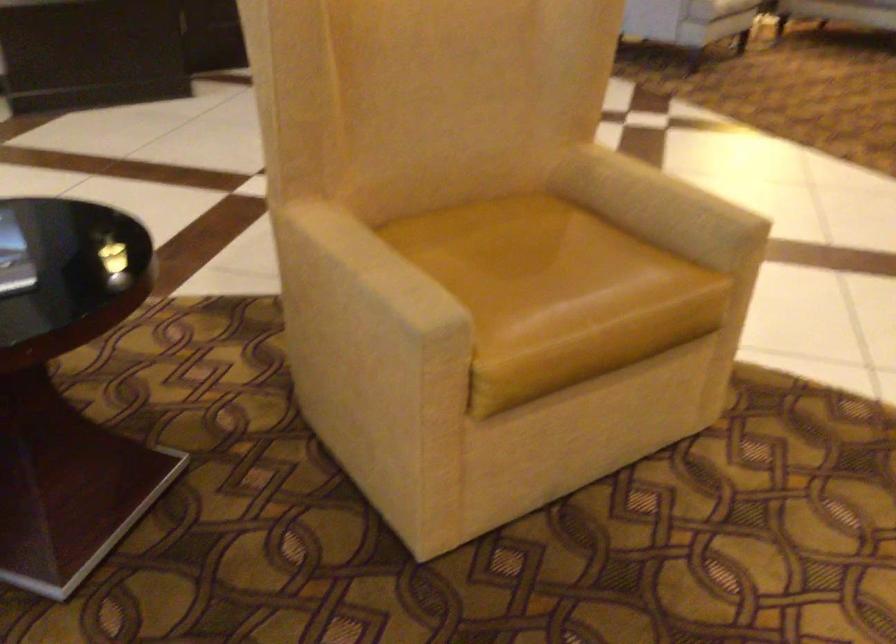
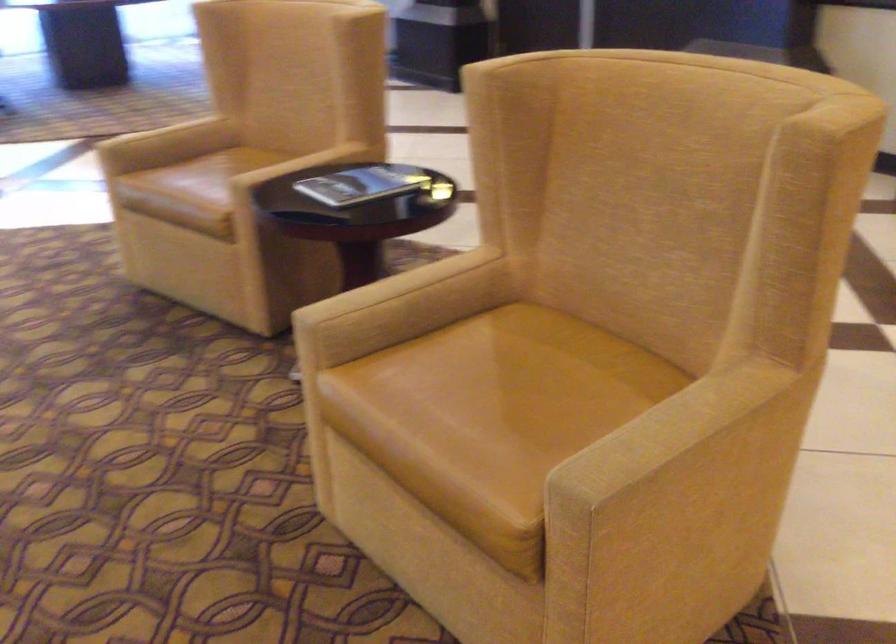
Question: I am providing you with two images of the same scene from different viewpoints. Please identify which objects are invisible in image2.

Choices:
 (A) tan chair armrest
 (B) black book
 (C) brown chair sitting surface
 (D) none of these

Answer: (D)